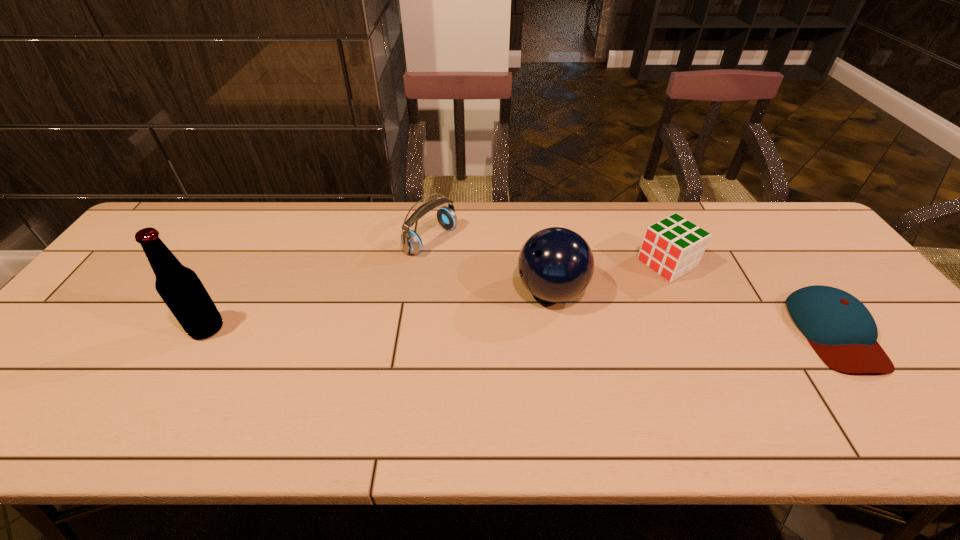
Where is `free spot on the desktop that is between the beer bottle and the baseball cap and is positioned on the red face of the cube`? The image size is (960, 540). free spot on the desktop that is between the beer bottle and the baseball cap and is positioned on the red face of the cube is located at coordinates (550, 330).

Identify the location of free spot on the desktop that is between the leftmost object and the baseball cap and is positioned on the ear cups of the headset. (589, 330).

Identify the location of free space on the desktop that is between the beer bottle and the rightmost object and is positioned on the surface of the bowling ball near the finger holes. (487, 330).